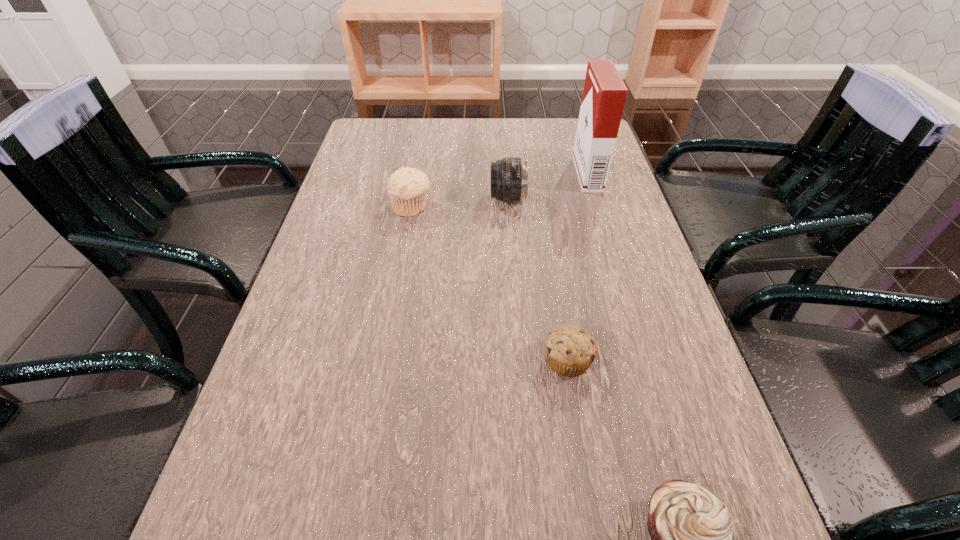
Locate an element on the screen. Image resolution: width=960 pixels, height=540 pixels. the tallest object is located at coordinates (x=604, y=94).

Locate an element on the screen. The height and width of the screenshot is (540, 960). telephoto lens is located at coordinates (509, 176).

Locate an element on the screen. The image size is (960, 540). the tallest muffin is located at coordinates (407, 187).

You are a GUI agent. You are given a task and a screenshot of the screen. Output one action in this format:
    pyautogui.click(x=<x>, y=<y>)
    Task: Click on the leftmost object
    
    Given the screenshot: What is the action you would take?
    pyautogui.click(x=407, y=187)

Locate an element on the screen. This screenshot has height=540, width=960. the fourth farthest object is located at coordinates (570, 350).

Locate an element on the screen. The height and width of the screenshot is (540, 960). the second muffin from right to left is located at coordinates (570, 350).

Find the location of a particular element. Image resolution: width=960 pixels, height=540 pixels. vacant space situated 0.110m on the front-facing side of the cigarette_case is located at coordinates click(538, 173).

At what (x,y) coordinates should I click in order to perform the action: click on vacant region located on the front-facing side of the cigarette_case. Please return your answer as a coordinate pair (x, y). The image size is (960, 540). Looking at the image, I should click on [x=548, y=173].

Find the location of a particular element. This screenshot has width=960, height=540. vacant space situated on the front-facing side of the cigarette_case is located at coordinates pyautogui.click(x=527, y=173).

Identify the location of vacant area situated 0.390m at the front element of the telephoto lens. (342, 199).